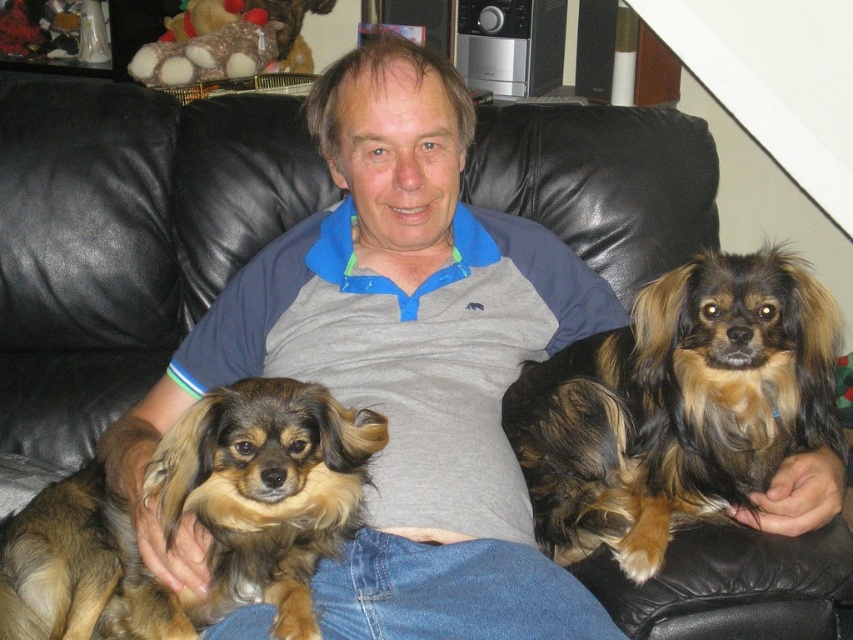
What is located at the coordinate point (676, 406) in the image?

The brown shaggy dog at right is located at point (676, 406).

You are a photographer trying to capture both the brown shaggy dog at right and the fuzzy brown dog at center in a single frame. Based on their positions and sizes, which dog might require more space in the frame to avoid being cropped out?

The brown shaggy dog at right might be wider than the fuzzy brown dog at center, so it might require more space in the frame to avoid being cropped out.